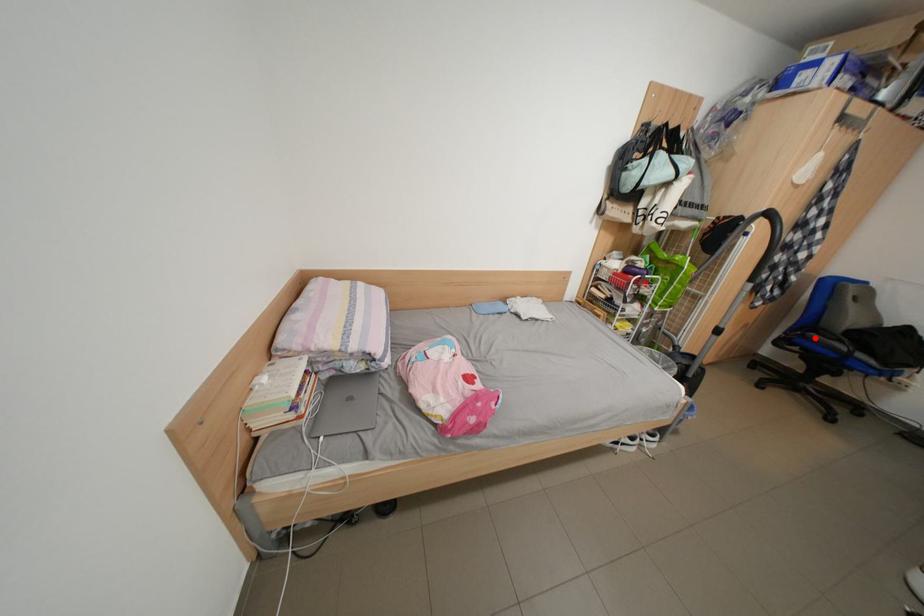
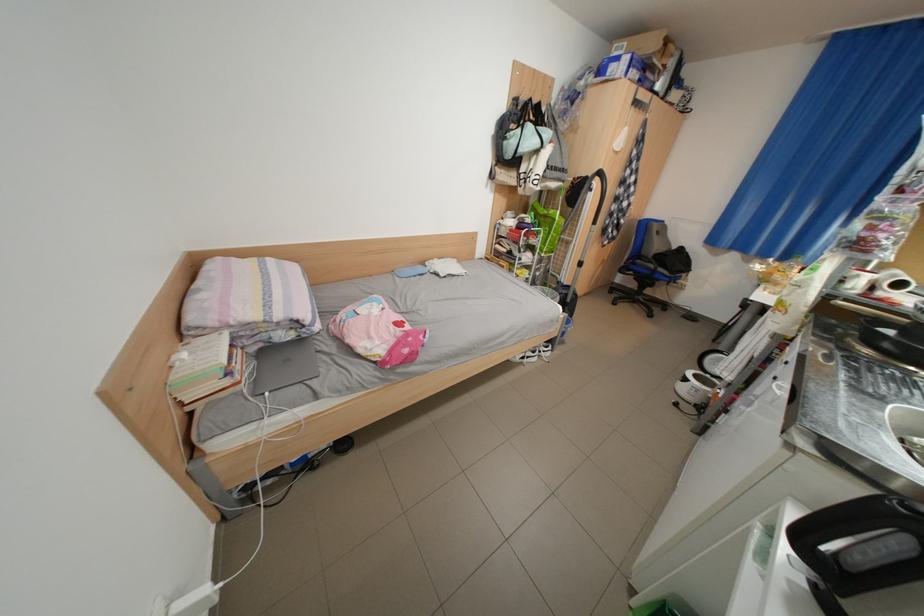
Question: A red point is marked in image1. In image2, is the corresponding 3D point closer to the camera or farther? Reply with the corresponding letter.

Choices:
 (A) The corresponding 3D point is closer.
 (B) The corresponding 3D point is farther.

Answer: (A)